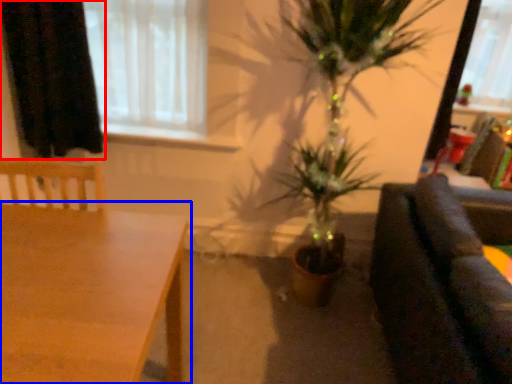
Question: Among these objects, which one is nearest to the camera, curtain (highlighted by a red box) or table (highlighted by a blue box)?

Choices:
 (A) curtain
 (B) table

Answer: (B)